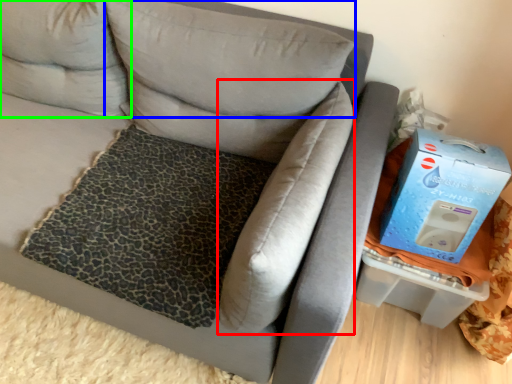
Question: Which object is positioned closest to pillow (highlighted by a red box)? Select from pillow (highlighted by a blue box) and pillow (highlighted by a green box).

Choices:
 (A) pillow
 (B) pillow

Answer: (A)